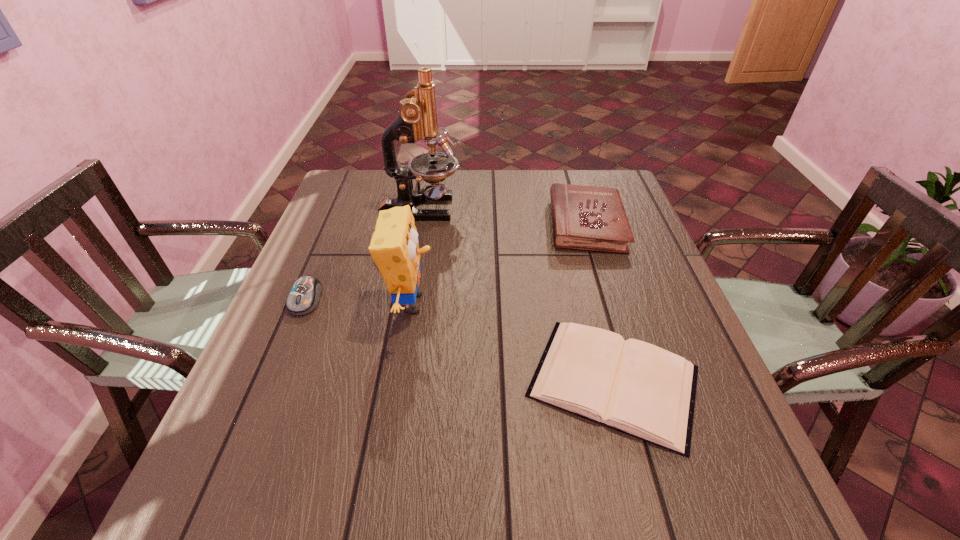
At what (x,y) coordinates should I click in order to perform the action: click on free space at the near edge of the desktop. Please return your answer as a coordinate pair (x, y). This screenshot has width=960, height=540. Looking at the image, I should click on (507, 523).

In order to click on free location at the left edge in this screenshot , I will do `click(290, 287)`.

The height and width of the screenshot is (540, 960). I want to click on vacant region at the right edge of the desktop, so click(x=646, y=265).

This screenshot has height=540, width=960. Identify the location of free space at the far left corner of the desktop. coord(357,199).

Image resolution: width=960 pixels, height=540 pixels. Identify the location of vacant area at the near left corner. (195, 501).

At what (x,y) coordinates should I click in order to perform the action: click on vacant space that is in between the sponge and the computer mouse. Please return your answer as a coordinate pair (x, y). Looking at the image, I should click on (359, 301).

This screenshot has height=540, width=960. In order to click on vacant area that lies between the farther hardback book and the microscope in this screenshot , I will do `click(503, 217)`.

Identify the location of empty space between the shorter hardback book and the farther hardback book. (600, 303).

Locate an element on the screen. The width and height of the screenshot is (960, 540). free space between the fourth tallest object and the tallest object is located at coordinates (363, 254).

I want to click on empty space between the farther hardback book and the tallest object, so click(503, 217).